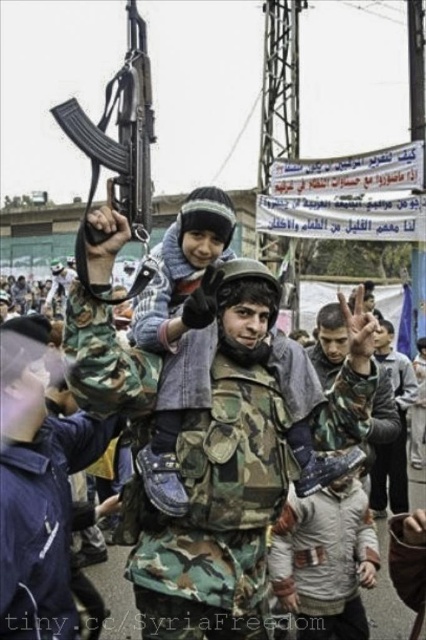
You are a photographer analyzing this image. You notice two points marked at coordinates point (213, 353) and point (388, 376). Which of these points is located closer to the viewer?

Point (213, 353) is closer to the viewer than point (388, 376).